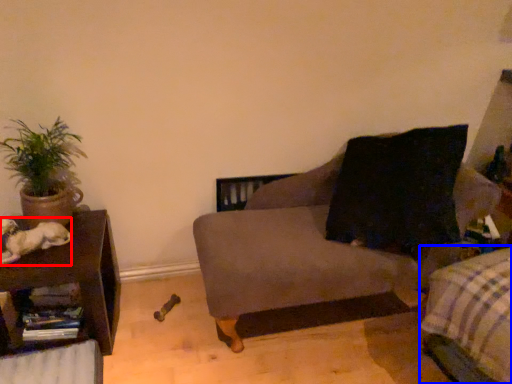
Question: Which of the following is the farthest to the observer, animal (highlighted by a red box) or bedding (highlighted by a blue box)?

Choices:
 (A) animal
 (B) bedding

Answer: (A)